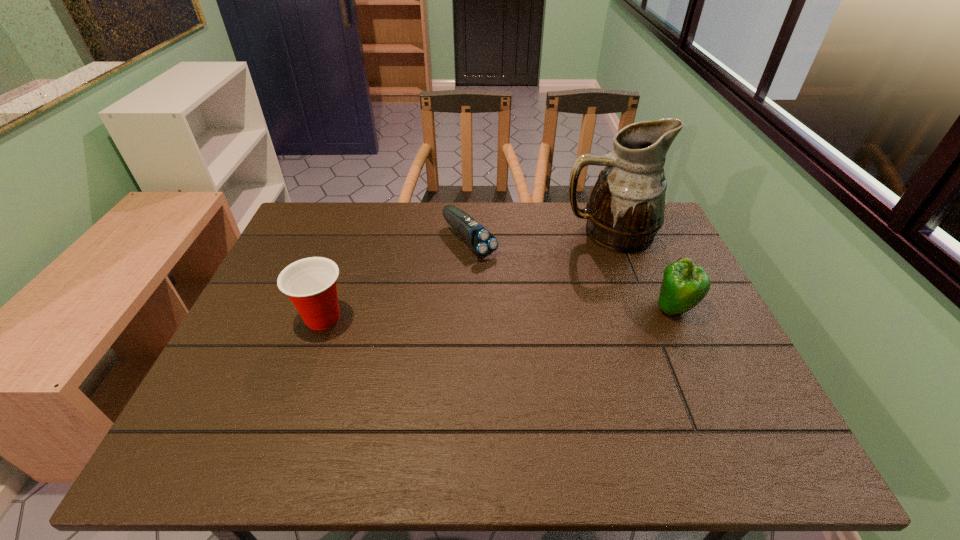
Find the location of a particular element. The image size is (960, 540). free spot on the desktop that is between the cup and the third shortest object and is positioned on the head of the electric shaver is located at coordinates (549, 312).

Identify the location of free space on the desktop that is between the second shortest object and the bell pepper and is positioned from the spout of the pitcher. The width and height of the screenshot is (960, 540). (477, 314).